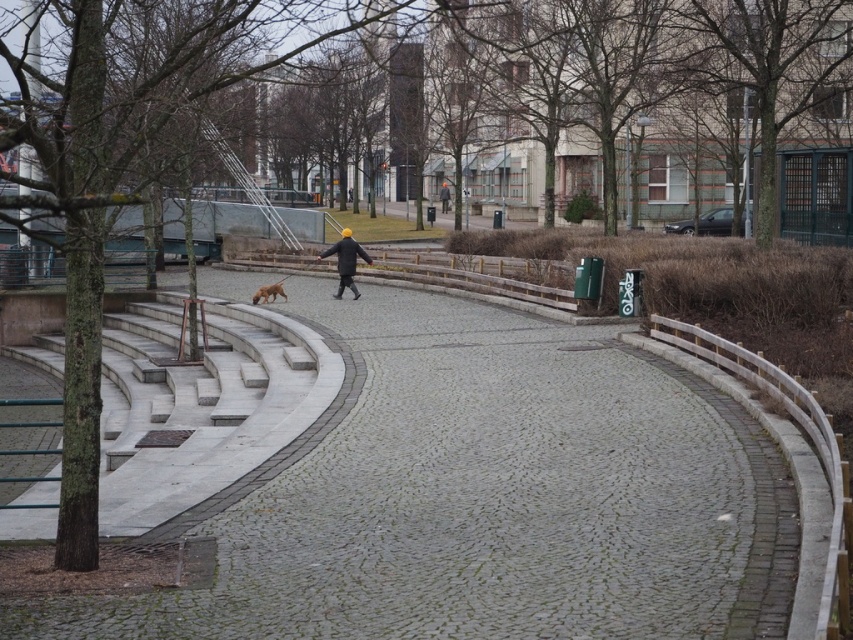
Question: Is brown fur dog at center closer to the viewer compared to matte black jacket at center?

Choices:
 (A) no
 (B) yes

Answer: (B)

Question: Can you confirm if white marble stairs at left is bigger than brown fur dog at center?

Choices:
 (A) yes
 (B) no

Answer: (A)

Question: Which point is closer to the camera taking this photo?

Choices:
 (A) (268, 296)
 (B) (440, 192)
 (C) (346, 280)

Answer: (A)

Question: Which object appears farthest from the camera in this image?

Choices:
 (A) dark gray woolen coat at center
 (B) white marble stairs at left
 (C) matte black jacket at center

Answer: (C)

Question: Can you confirm if gray cobblestone pavement at center is positioned to the left of white marble stairs at left?

Choices:
 (A) no
 (B) yes

Answer: (A)

Question: Which point is closer to the camera?

Choices:
 (A) white marble stairs at left
 (B) gray cobblestone pavement at center
 (C) dark gray woolen coat at center
 (D) matte black jacket at center

Answer: (B)